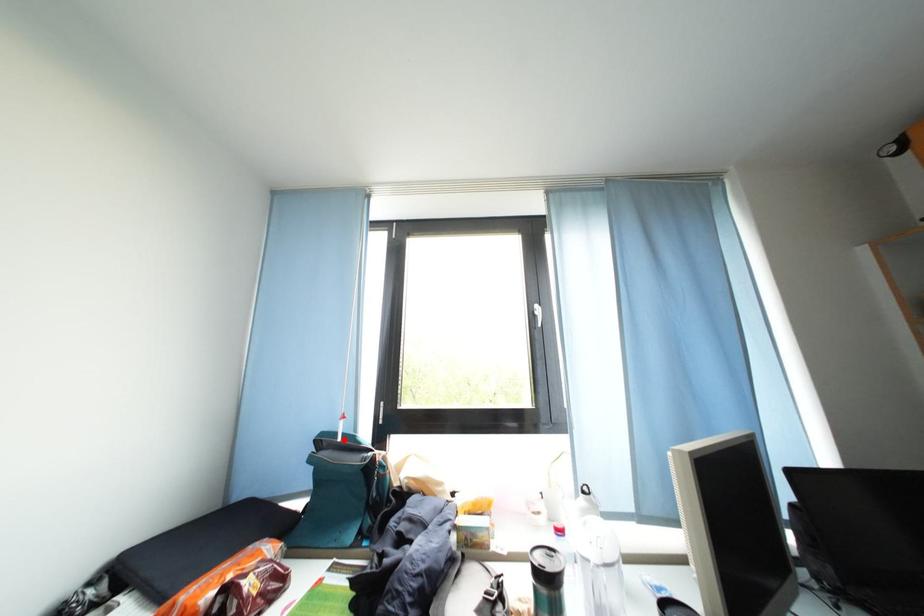
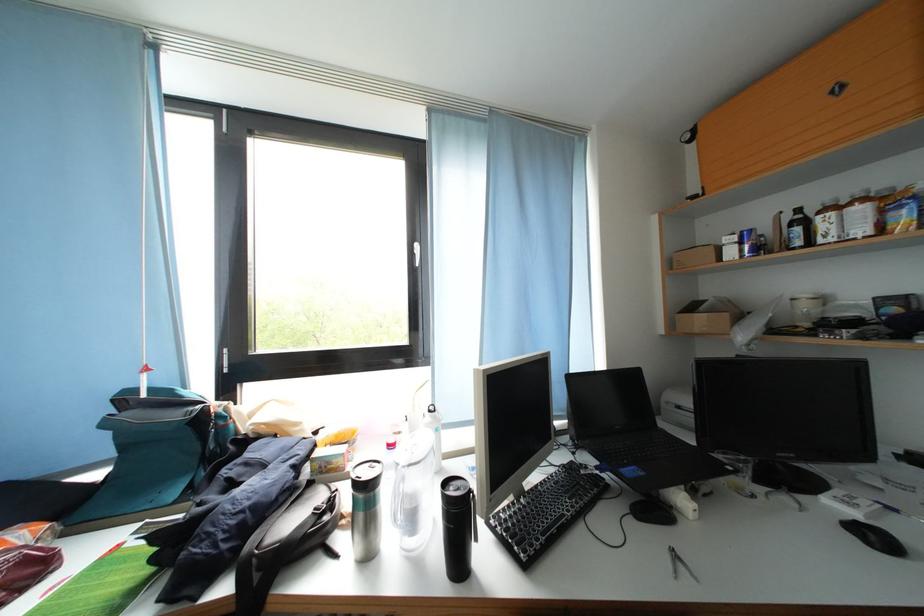
Find the pixel in the second image that matches the highlighted location in the first image.

(142, 397)